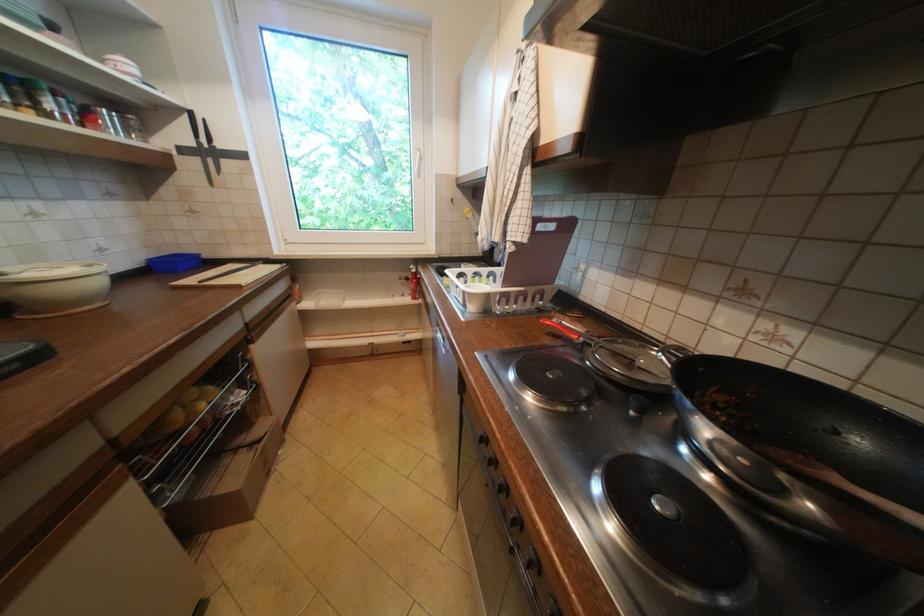
What do you see at coordinates (418, 163) in the screenshot?
I see `the white window handle` at bounding box center [418, 163].